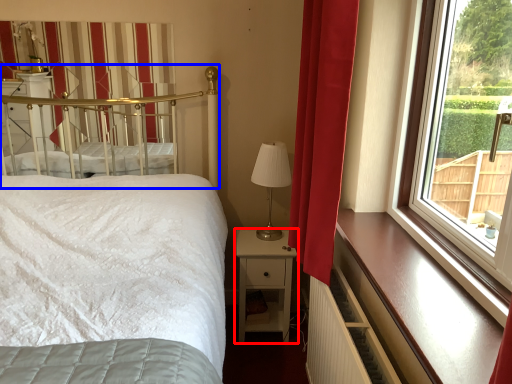
Question: Among these objects, which one is nearest to the camera, nightstand (highlighted by a red box) or canopy bed (highlighted by a blue box)?

Choices:
 (A) nightstand
 (B) canopy bed

Answer: (B)